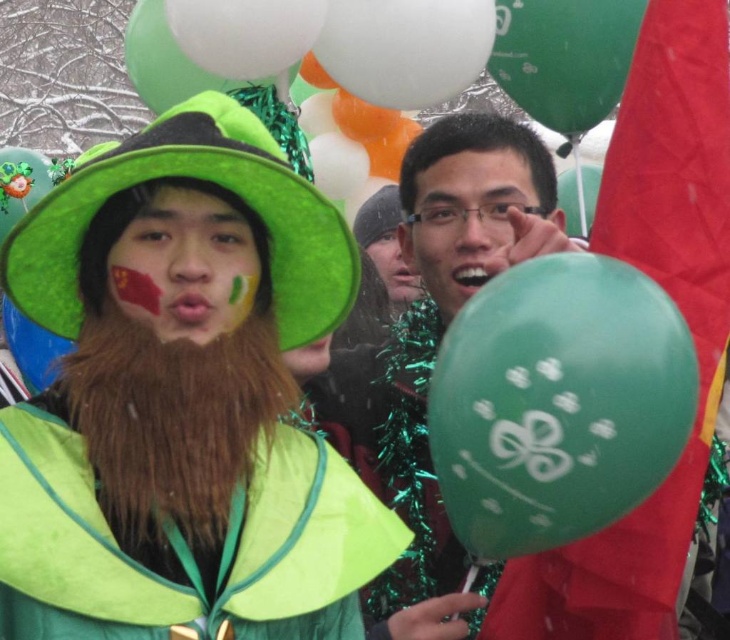
You are a photographer trying to capture a closeup shot of both the brown fuzzy beard at center and the matte green hat at center in the scene. Given that your camera can focus on objects within a 25 inch range, will you be able to capture both subjects clearly in the same photo?

The brown fuzzy beard at center is 28.16 inches away from the matte green hat at center. Since the distance between them exceeds the camera focus range of 25 inches, you won

You are at a St. Patrick Day parade and want to take a photo of the green glossy balloon at center and the brown fuzzy beard at center. Which object should you zoom in on to capture more details?

The green glossy balloon at center is bigger than the brown fuzzy beard at center, so you should zoom in on the green glossy balloon at center to capture more details.

You are a photographer trying to capture a clear photo of both the brown fuzzy beard at center and the matte green hat at center. Since you can only focus on one object at a time, which one should you focus on to ensure the other is also in focus?

You should focus on the brown fuzzy beard at center because it is closer to the viewer than the matte green hat at center. By focusing on the closer object, the depth of field may include the farther object in acceptable focus.